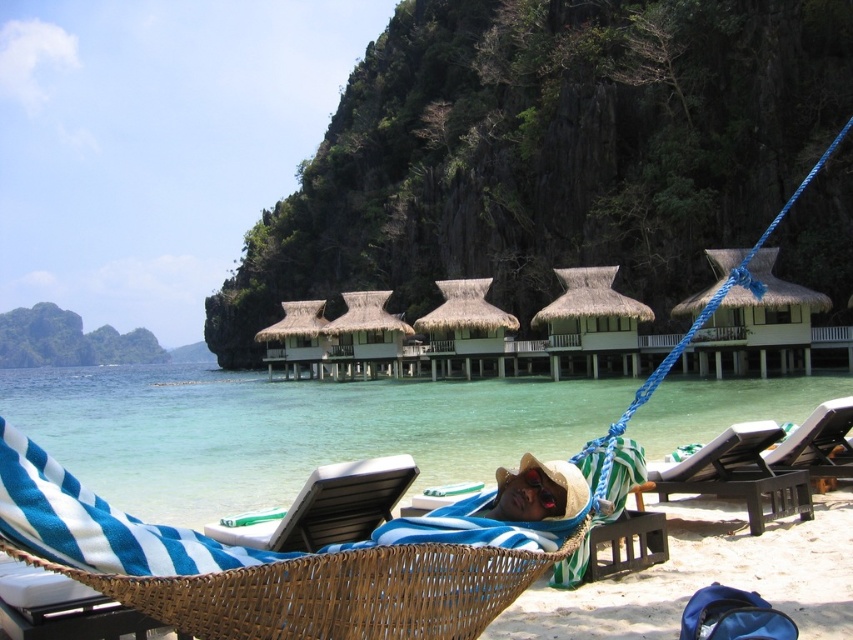
You are a guest at the tropical resort and want to take a photo of the blue striped fabric at center and the thatched straw hut at center from a position where both are visible. Based on their positions, which object will appear larger in your photo?

The blue striped fabric at center will appear larger in the photo because it is closer to the viewer than the thatched straw hut at center.

You are standing at the point marked as point (631, 552) on the beach. A lifeguard tower is located 100 feet away from you. Can you see the lifeguard tower from your current position?

The distance between you and point (631, 552) is 93.82 feet, which is less than 100 feet. Therefore, the lifeguard tower is beyond your current position, so you might be able to see it depending on the terrain.

You are standing at the beach and want to take a photo of both the point at location (x=723, y=490) and the point at (x=634, y=476). Which point should you focus on first to ensure both are in sharp focus?

You should focus on point (x=634, y=476) first because it is closer to you than point (x=723, y=490), which is further away. By focusing on the closer point, the further one will also be in focus if within the depth of field.